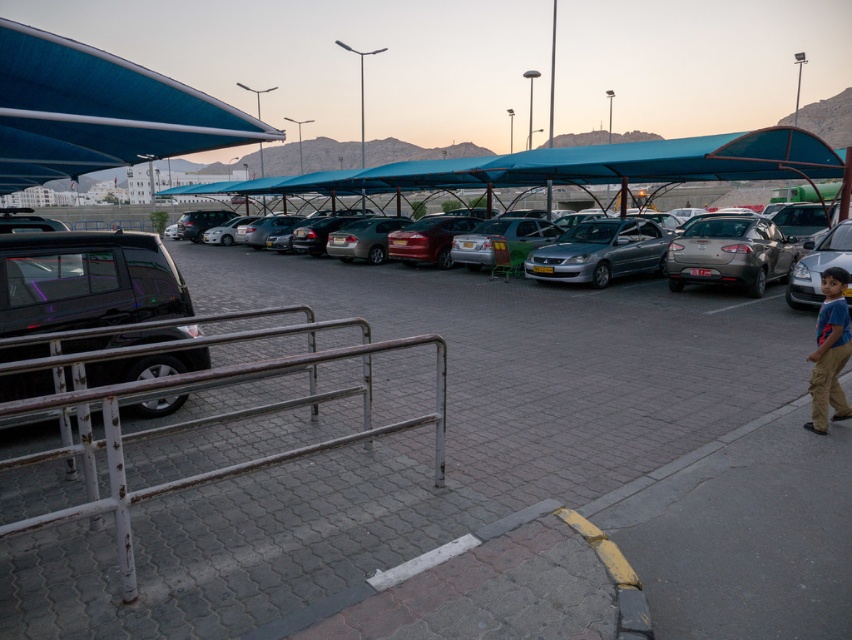
Does point (409, 269) come behind point (842, 301)?

Yes, it is.

Is point (783, 225) more distant than point (816, 401)?

Yes.

The image size is (852, 640). In order to click on silver metallic sedan at center in this screenshot , I will do `click(816, 266)`.

Does metallic black car at left have a larger size compared to satin silver sedan at center?

Yes, metallic black car at left is bigger than satin silver sedan at center.

Who is more distant from viewer, (407, 609) or (576, 275)?

The point (576, 275) is more distant.

Is point (225, 269) farther from viewer compared to point (608, 268)?

Yes, point (225, 269) is farther from viewer.

The image size is (852, 640). I want to click on metallic black car at left, so click(x=493, y=483).

Between rusty metal rail at lower left and silver metallic sedan at right, which one is positioned higher?

Positioned higher is silver metallic sedan at right.

Is rusty metal rail at lower left taller than silver metallic sedan at right?

No.

What are the coordinates of `rusty metal rail at lower left` in the screenshot? It's located at (199, 422).